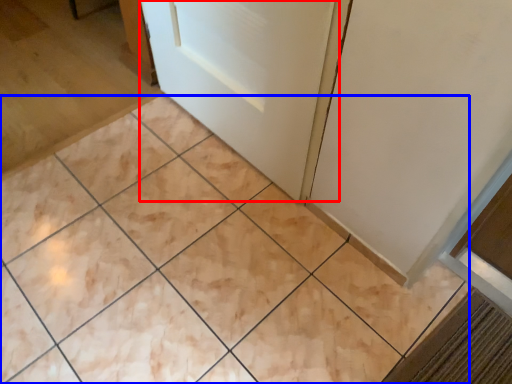
Question: Which point is further to the camera, door (highlighted by a red box) or ceramic tile (highlighted by a blue box)?

Choices:
 (A) door
 (B) ceramic tile

Answer: (A)